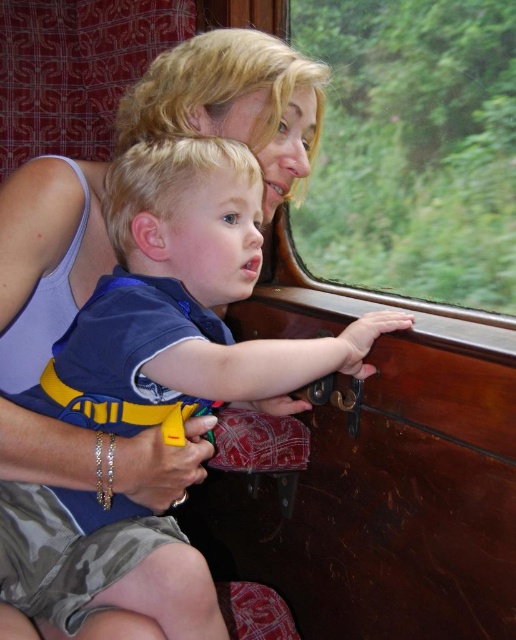
You are a photographer inside the vintage train carriage. You want to take a photo of the child wearing the blue cotton shirt at center and the transparent glass window at upper center. Which object is positioned closer to you when focusing your camera?

The blue cotton shirt at center is closer to the viewer than the transparent glass window at upper center, so when focusing your camera, the blue cotton shirt at center will be the closer object.

You are a tailor who needs to determine which item in the scene is larger in size between the blue cotton shirt at center and the transparent glass window at upper center. Based on the scene description, which one is bigger?

The blue cotton shirt at center is bigger than the transparent glass window at upper center according to the description.

You are a photographer carrying a camera and want to take a picture of the blue cotton shirt at center. The minimum focusing distance of your camera is 24 inches. Can you take the photo without moving closer?

The blue cotton shirt at center and camera are 23.58 inches apart from each other, which is less than the minimum focusing distance of 24 inches. Therefore, you cannot take the photo without moving closer.